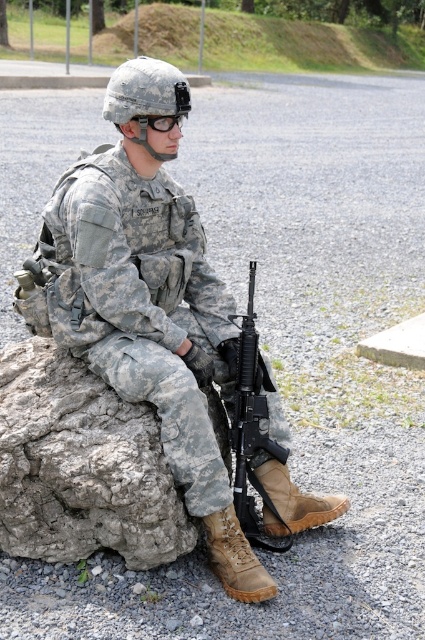
You are a photographer wanting to capture the soldier and the objects in the scene. If you want to ensure both the gray rough rock at lower left and the black matte rifle at lower center are fully visible in the frame, which object should you position closer to the camera to avoid cropping?

The gray rough rock at lower left might be wider than black matte rifle at lower center, so positioning the gray rough rock at lower left closer to the camera would help ensure both fit within the frame without cropping.

Based on the coordinates provided, where is the camouflage uniform at center positioned in the image?

The camouflage uniform at center is positioned at coordinates point [147,300].